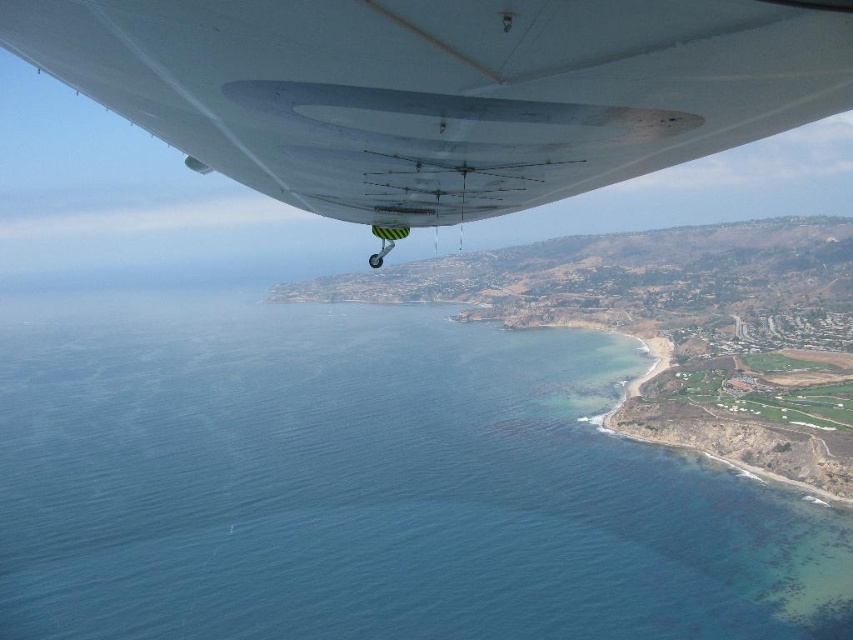
You are a pilot flying an aircraft and looking out the window. You notice a point marked at coordinates [369,484]. Based on the scene, where is this point located?

The point is on blue water at lower left.

You are a pilot flying the aircraft and need to check if the blue water at lower left is larger than the white matte wing at upper center. Based on the scene, can you confirm this?

The blue water at lower left has a larger size compared to the white matte wing at upper center, so yes, the blue water at lower left is indeed larger than the white matte wing at upper center.

You are a passenger sitting in the aircraft and looking out the window. You see the blue water at lower left and the white matte wing at upper center. Which object is closer to you from your viewing position?

The white matte wing at upper center is closer to you because it is positioned above the blue water at lower left, which is located further away beneath it.